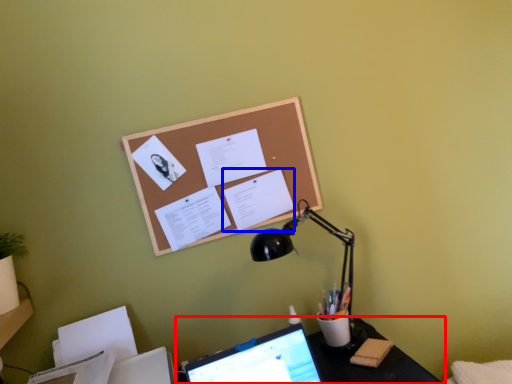
Question: Which point is further to the camera, desk (highlighted by a red box) or document (highlighted by a blue box)?

Choices:
 (A) desk
 (B) document

Answer: (B)